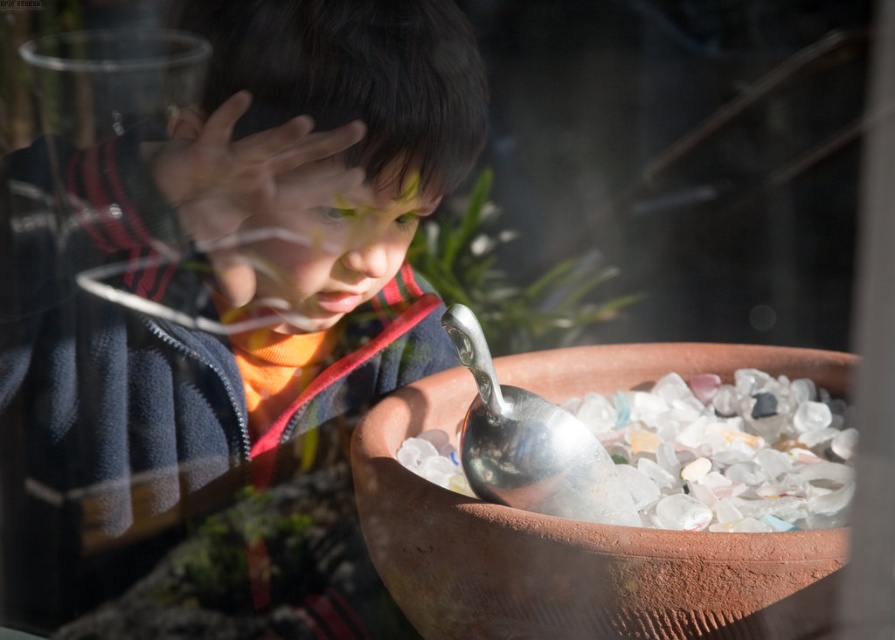
Question: Is smooth skin hand at center bigger than silver metallic spoon at lower center?

Choices:
 (A) no
 (B) yes

Answer: (B)

Question: Does matte black jacket at upper left have a greater width compared to terracotta clay bowl at center?

Choices:
 (A) yes
 (B) no

Answer: (B)

Question: Estimate the real-world distances between objects in this image. Which object is closer to the silver metallic spoon at lower center?

Choices:
 (A) matte black jacket at upper left
 (B) smooth skin hand at center
 (C) terracotta clay bowl at center

Answer: (C)

Question: Which is farther from the smooth skin hand at center?

Choices:
 (A) matte black jacket at upper left
 (B) terracotta clay bowl at center

Answer: (B)

Question: Can you confirm if matte black jacket at upper left is positioned to the left of terracotta clay bowl at center?

Choices:
 (A) yes
 (B) no

Answer: (A)

Question: Among these objects, which one is nearest to the camera?

Choices:
 (A) smooth skin hand at center
 (B) silver metallic spoon at lower center
 (C) matte black jacket at upper left

Answer: (A)